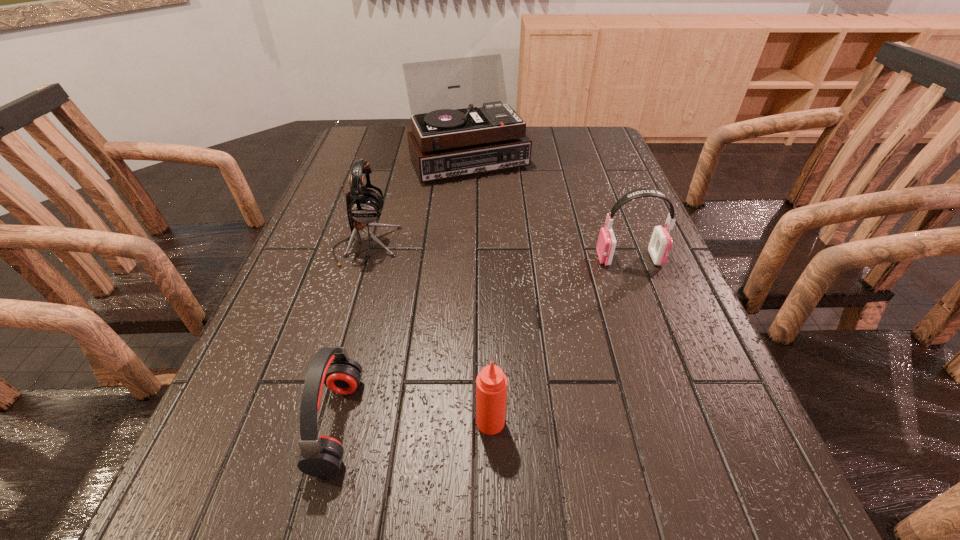
Locate an element on the screen. free spot between the rightmost object and the record player is located at coordinates (549, 208).

I want to click on free spot between the record player and the Tabasco sauce, so click(x=480, y=289).

The height and width of the screenshot is (540, 960). Find the location of `free spot between the shortest earphone and the Tabasco sauce`. free spot between the shortest earphone and the Tabasco sauce is located at coordinates pyautogui.click(x=414, y=423).

The height and width of the screenshot is (540, 960). I want to click on vacant point located between the Tabasco sauce and the shortest earphone, so click(414, 423).

Find the location of a particular element. free space between the second tallest earphone and the record player is located at coordinates (549, 208).

Locate which object ranks third in proximity to the Tabasco sauce. Please provide its 2D coordinates. Your answer should be formatted as a tuple, i.e. [(x, y)], where the tuple contains the x and y coordinates of a point satisfying the conditions above.

[(660, 244)]

Image resolution: width=960 pixels, height=540 pixels. I want to click on object that is the nearest to the second shortest earphone, so click(452, 135).

Point out which earphone is positioned as the nearest to the Tabasco sauce. Please provide its 2D coordinates. Your answer should be formatted as a tuple, i.e. [(x, y)], where the tuple contains the x and y coordinates of a point satisfying the conditions above.

[(321, 456)]

I want to click on the second closest earphone relative to the record player, so click(660, 244).

The image size is (960, 540). Identify the location of free point that satisfies the following two spatial constraints: 1. on the front side of the record player; 2. on the right side of the Tabasco sauce. (459, 422).